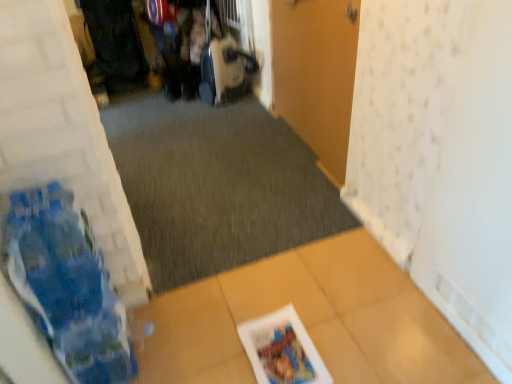
Question: Can printed paper magazine at lower center be found inside dark gray carpet at center?

Choices:
 (A) no
 (B) yes

Answer: (A)

Question: Does dark gray carpet at center have a lesser height compared to printed paper magazine at lower center?

Choices:
 (A) no
 (B) yes

Answer: (A)

Question: Is there a large distance between dark gray carpet at center and printed paper magazine at lower center?

Choices:
 (A) no
 (B) yes

Answer: (A)

Question: Is dark gray carpet at center taller than printed paper magazine at lower center?

Choices:
 (A) yes
 (B) no

Answer: (A)

Question: Is dark gray carpet at center closer to camera compared to printed paper magazine at lower center?

Choices:
 (A) yes
 (B) no

Answer: (B)

Question: From the image's perspective, is dark gray carpet at center above or below wooden door at center?

Choices:
 (A) above
 (B) below

Answer: (B)

Question: Looking at their shapes, would you say dark gray carpet at center is wider or thinner than wooden door at center?

Choices:
 (A) thin
 (B) wide

Answer: (B)

Question: Considering their positions, is dark gray carpet at center located in front of or behind wooden door at center?

Choices:
 (A) behind
 (B) front

Answer: (A)

Question: Considering the positions of dark gray carpet at center and wooden door at center in the image, is dark gray carpet at center bigger or smaller than wooden door at center?

Choices:
 (A) big
 (B) small

Answer: (A)

Question: From a real-world perspective, is dark gray carpet at center above or below printed paper magazine at lower center?

Choices:
 (A) above
 (B) below

Answer: (B)

Question: Is dark gray carpet at center wider or thinner than printed paper magazine at lower center?

Choices:
 (A) thin
 (B) wide

Answer: (B)

Question: Is point (158, 137) closer or farther from the camera than point (271, 344)?

Choices:
 (A) closer
 (B) farther

Answer: (B)

Question: Choose the correct answer: Is dark gray carpet at center inside printed paper magazine at lower center or outside it?

Choices:
 (A) inside
 (B) outside

Answer: (B)

Question: From the image's perspective, is printed paper magazine at lower center above or below wooden door at center?

Choices:
 (A) above
 (B) below

Answer: (B)

Question: Based on their sizes in the image, would you say printed paper magazine at lower center is bigger or smaller than wooden door at center?

Choices:
 (A) small
 (B) big

Answer: (A)